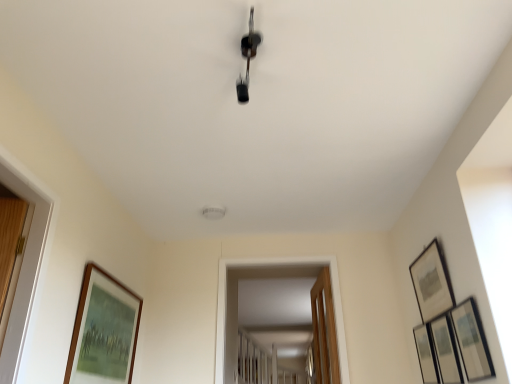
Question: Considering the relative sizes of wooden framed picture at right, which is the fourth picture frame from left to right, and matte black picture frame at upper right, which appears as the third picture frame when viewed from the left, in the image provided, is wooden framed picture at right, which is the fourth picture frame from left to right, bigger than matte black picture frame at upper right, which appears as the third picture frame when viewed from the left,?

Choices:
 (A) yes
 (B) no

Answer: (B)

Question: Is wooden framed picture at right, acting as the second picture frame starting from the right, positioned behind matte black picture frame at upper right, which appears as the third picture frame when viewed from the left?

Choices:
 (A) no
 (B) yes

Answer: (A)

Question: Does wooden framed picture at right, acting as the second picture frame starting from the right, touch matte black picture frame at upper right, which appears as the 3th picture frame when viewed from the right?

Choices:
 (A) no
 (B) yes

Answer: (A)

Question: Is wooden framed picture at right, which is the fourth picture frame from left to right, oriented towards matte black picture frame at upper right, which appears as the third picture frame when viewed from the left?

Choices:
 (A) no
 (B) yes

Answer: (A)

Question: Does wooden framed picture at right, acting as the second picture frame starting from the right, have a lesser width compared to matte black picture frame at upper right, which appears as the third picture frame when viewed from the left?

Choices:
 (A) no
 (B) yes

Answer: (B)

Question: From the image's perspective, relative to wooden framed picture at right, which is the fourth picture frame from left to right, is wooden-framed painting at lower left, acting as the 1th picture frame starting from the left, above or below?

Choices:
 (A) above
 (B) below

Answer: (A)

Question: Is point (132, 314) closer or farther from the camera than point (448, 379)?

Choices:
 (A) farther
 (B) closer

Answer: (A)

Question: Which is correct: wooden-framed painting at lower left, the 5th picture frame in the right-to-left sequence, is inside wooden framed picture at right, acting as the second picture frame starting from the right, or outside of it?

Choices:
 (A) inside
 (B) outside

Answer: (B)

Question: Relative to wooden framed picture at right, acting as the second picture frame starting from the right, is wooden-framed painting at lower left, the 5th picture frame in the right-to-left sequence, in front or behind?

Choices:
 (A) behind
 (B) front

Answer: (B)

Question: Does point (424, 375) appear closer or farther from the camera than point (123, 294)?

Choices:
 (A) closer
 (B) farther

Answer: (A)

Question: Is metallic silver picture frame at right, which is the 5th picture frame from left to right, bigger or smaller than wooden-framed painting at lower left, acting as the 1th picture frame starting from the left?

Choices:
 (A) big
 (B) small

Answer: (B)

Question: Choose the correct answer: Is metallic silver picture frame at right, the first picture frame from the right, inside wooden-framed painting at lower left, the 5th picture frame in the right-to-left sequence, or outside it?

Choices:
 (A) outside
 (B) inside

Answer: (A)

Question: In the image, is metallic silver picture frame at right, the first picture frame from the right, positioned in front of or behind wooden-framed painting at lower left, the 5th picture frame in the right-to-left sequence?

Choices:
 (A) behind
 (B) front

Answer: (A)

Question: From a real-world perspective, relative to wooden-framed painting at lower left, acting as the 1th picture frame starting from the left, is matte black picture frame at upper right, which appears as the third picture frame when viewed from the left, vertically above or below?

Choices:
 (A) above
 (B) below

Answer: (A)

Question: Is matte black picture frame at upper right, which appears as the 3th picture frame when viewed from the right, wider or thinner than wooden-framed painting at lower left, acting as the 1th picture frame starting from the left?

Choices:
 (A) thin
 (B) wide

Answer: (A)